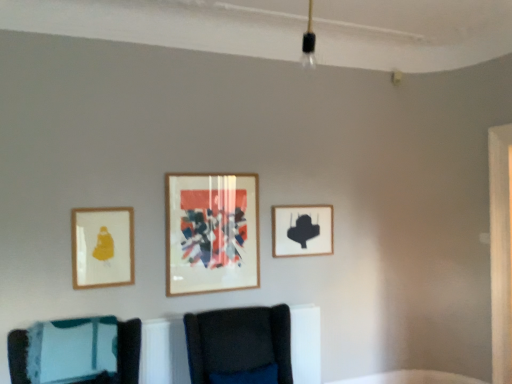
Question: Is matte gold picture frame at left, arranged as the 1th picture frame when viewed from the front, surrounding velvet dark blue chair at center, arranged as the 1th furniture when viewed from the right?

Choices:
 (A) no
 (B) yes

Answer: (A)

Question: Is matte gold picture frame at left, the 3th picture frame in the back-to-front sequence, positioned behind velvet dark blue chair at center, which appears as the second furniture when viewed from the left?

Choices:
 (A) no
 (B) yes

Answer: (B)

Question: Does matte gold picture frame at left, the 3th picture frame in the back-to-front sequence, have a greater height compared to velvet dark blue chair at center, which appears as the second furniture when viewed from the left?

Choices:
 (A) yes
 (B) no

Answer: (B)

Question: Is matte gold picture frame at left, the 3th picture frame in the back-to-front sequence, beside velvet dark blue chair at center, which appears as the second furniture when viewed from the left?

Choices:
 (A) yes
 (B) no

Answer: (B)

Question: Is matte gold picture frame at left, the first picture frame positioned from the left, to the right of velvet dark blue chair at center, which appears as the second furniture when viewed from the left, from the viewer's perspective?

Choices:
 (A) yes
 (B) no

Answer: (B)

Question: Is matte gold picture frame at left, marked as the 3th picture frame in a right-to-left arrangement, inside or outside of velvet dark blue chair at center, which appears as the second furniture when viewed from the left?

Choices:
 (A) outside
 (B) inside

Answer: (A)

Question: Relative to velvet dark blue chair at center, arranged as the 1th furniture when viewed from the right, is matte gold picture frame at left, the 3th picture frame in the back-to-front sequence, in front or behind?

Choices:
 (A) behind
 (B) front

Answer: (A)

Question: In terms of height, does matte gold picture frame at left, marked as the 3th picture frame in a right-to-left arrangement, look taller or shorter compared to velvet dark blue chair at center, which appears as the second furniture when viewed from the left?

Choices:
 (A) tall
 (B) short

Answer: (B)

Question: Considering the relative positions of matte gold picture frame at left, arranged as the 1th picture frame when viewed from the front, and velvet dark blue chair at center, arranged as the 1th furniture when viewed from the right, in the image provided, is matte gold picture frame at left, arranged as the 1th picture frame when viewed from the front, to the left or to the right of velvet dark blue chair at center, arranged as the 1th furniture when viewed from the right,?

Choices:
 (A) left
 (B) right

Answer: (A)

Question: From a real-world perspective, is teal fabric cushion at lower left, which is counted as the second furniture, starting from the right, physically located above or below black matte picture frame at upper right, the 3th picture frame from the left?

Choices:
 (A) above
 (B) below

Answer: (B)

Question: Considering their positions, is teal fabric cushion at lower left, arranged as the 1th furniture when viewed from the left, located in front of or behind black matte picture frame at upper right, arranged as the first picture frame when viewed from the right?

Choices:
 (A) front
 (B) behind

Answer: (A)

Question: Is teal fabric cushion at lower left, which is counted as the second furniture, starting from the right, bigger or smaller than black matte picture frame at upper right, acting as the third picture frame starting from the front?

Choices:
 (A) big
 (B) small

Answer: (A)

Question: Is teal fabric cushion at lower left, arranged as the 1th furniture when viewed from the left, taller or shorter than black matte picture frame at upper right, acting as the third picture frame starting from the front?

Choices:
 (A) short
 (B) tall

Answer: (B)

Question: In terms of size, does velvet dark blue chair at center, which appears as the second furniture when viewed from the left, appear bigger or smaller than black matte picture frame at upper right, which is the 1th picture frame from back to front?

Choices:
 (A) small
 (B) big

Answer: (B)

Question: Is velvet dark blue chair at center, arranged as the 1th furniture when viewed from the right, spatially inside black matte picture frame at upper right, which is the 1th picture frame from back to front, or outside of it?

Choices:
 (A) outside
 (B) inside

Answer: (A)